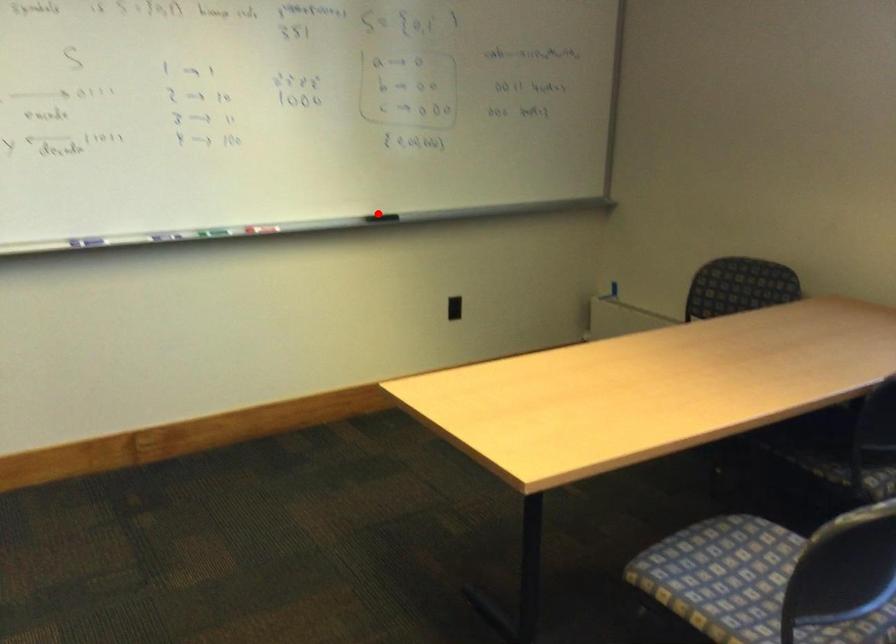
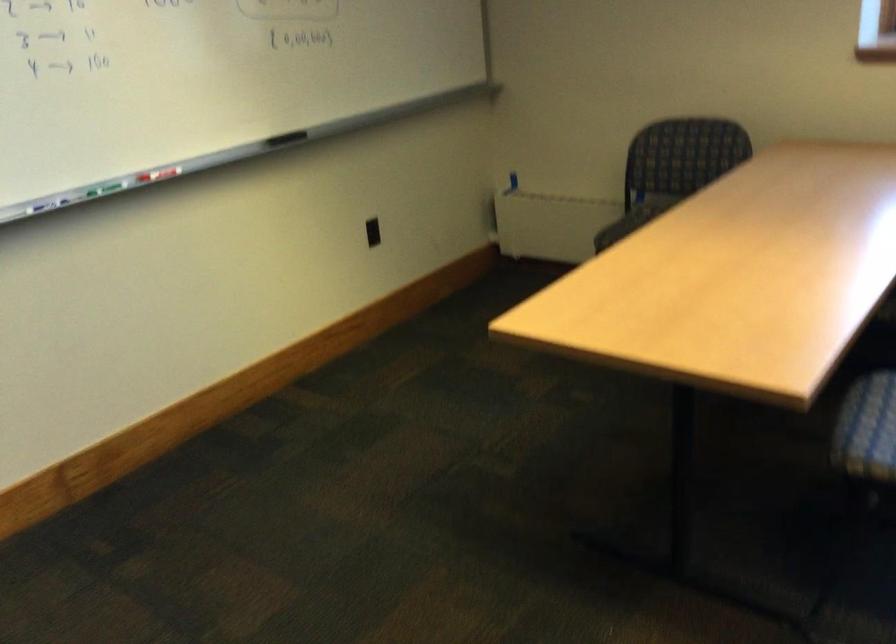
Where in the second image is the point corresponding to the highlighted location from the first image?

(286, 138)